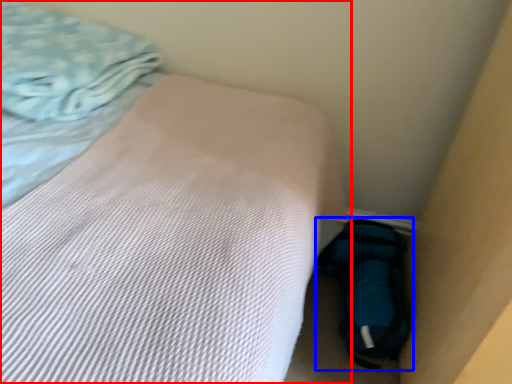
Question: Which object is further to the camera taking this photo, bed (highlighted by a red box) or sleeping bag (highlighted by a blue box)?

Choices:
 (A) bed
 (B) sleeping bag

Answer: (B)